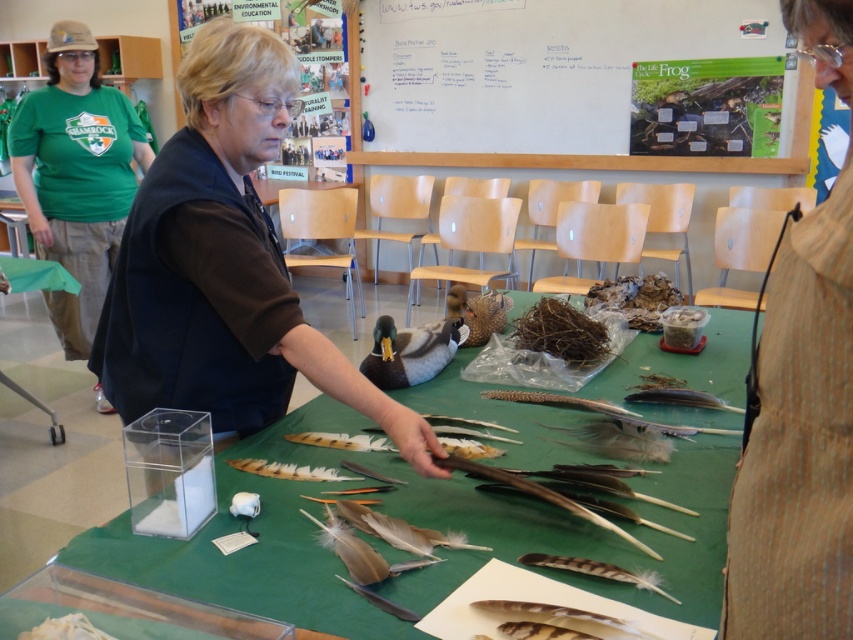
Question: Is green fabric shirt at upper left thinner than white fluffy feathers at lower left?

Choices:
 (A) yes
 (B) no

Answer: (B)

Question: Which object is farther from the camera taking this photo?

Choices:
 (A) matte brown duck at center
 (B) brown matte shirt at center
 (C) green fabric shirt at upper left

Answer: (C)

Question: Which object is positioned farthest from the white fluffy feathers at lower left?

Choices:
 (A) whiteboard at upper center
 (B) matte brown duck at center

Answer: (A)

Question: Is brown matte shirt at center further to camera compared to brown textured jacket at upper right?

Choices:
 (A) yes
 (B) no

Answer: (A)

Question: Does brown textured jacket at upper right have a smaller size compared to matte brown duck at center?

Choices:
 (A) no
 (B) yes

Answer: (A)

Question: Which of the following is the farthest from the observer?

Choices:
 (A) (59, 307)
 (B) (548, 348)
 (C) (384, 337)
 (D) (665, 36)

Answer: (D)